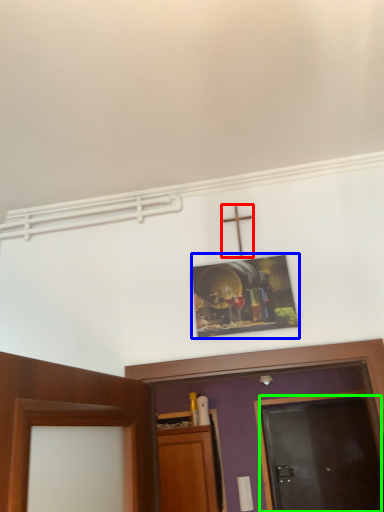
Question: Which is nearer to the crucifix (highlighted by a red box)? picture frame (highlighted by a blue box) or door (highlighted by a green box).

Choices:
 (A) picture frame
 (B) door

Answer: (A)